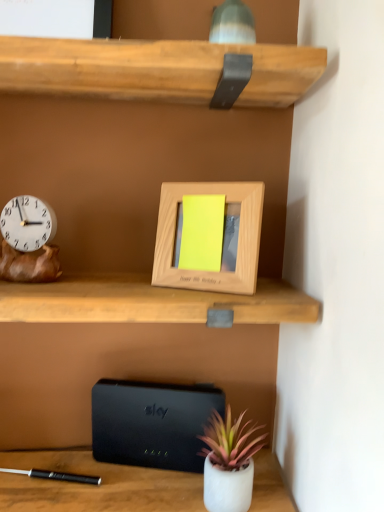
Question: Looking at their shapes, would you say matte white pot at lower center is wider or thinner than wooden clock at left?

Choices:
 (A) thin
 (B) wide

Answer: (B)

Question: Considering the positions of point (226, 408) and point (52, 230), is point (226, 408) closer or farther from the camera than point (52, 230)?

Choices:
 (A) farther
 (B) closer

Answer: (A)

Question: Considering the real-world distances, which object is closest to the matte white pot at lower center?

Choices:
 (A) wooden photo frame at center
 (B) wooden clock at left
 (C) black matte/black plastic at lower center

Answer: (C)

Question: Which object is the farthest from the wooden clock at left?

Choices:
 (A) wooden photo frame at center
 (B) black matte/black plastic at lower center
 (C) matte white pot at lower center

Answer: (C)